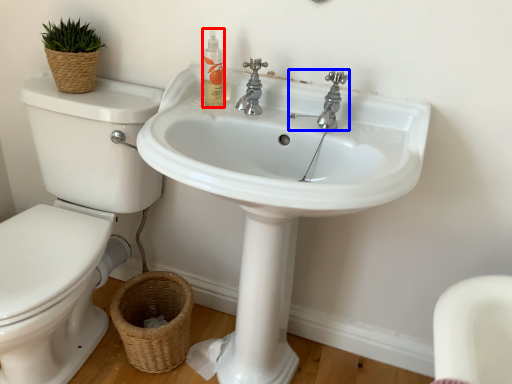
Question: Which object appears farthest to the camera in this image, cleaning product (highlighted by a red box) or tap (highlighted by a blue box)?

Choices:
 (A) cleaning product
 (B) tap

Answer: (A)